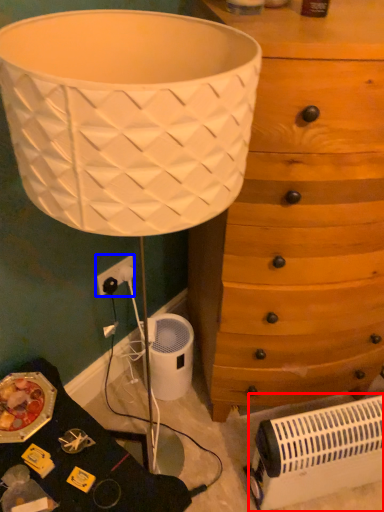
Question: Among these objects, which one is nearest to the camera, heater (highlighted by a red box) or electric outlet (highlighted by a blue box)?

Choices:
 (A) heater
 (B) electric outlet

Answer: (A)